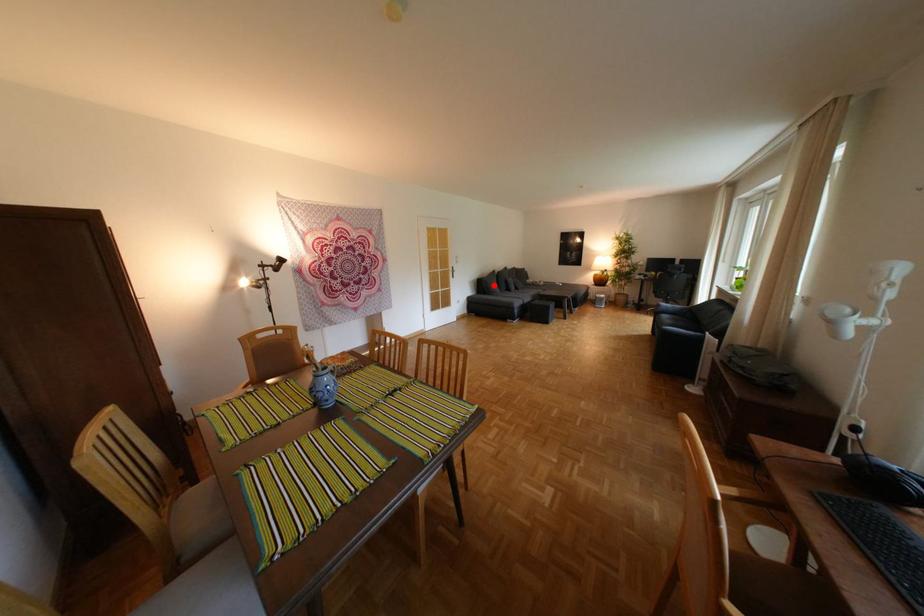
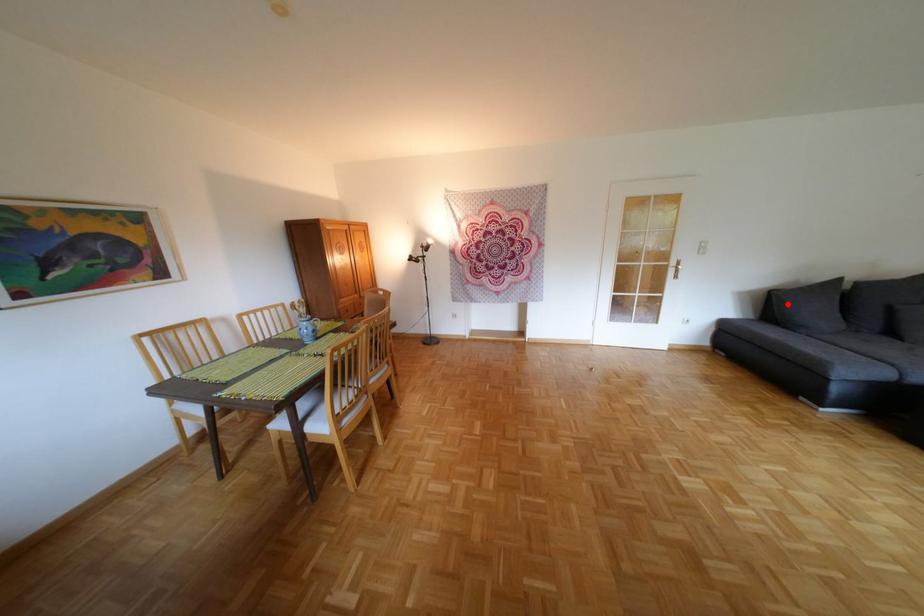
Consider the image. I am providing you with two images of the same scene from different viewpoints. A red point is marked on the first image and another point is marked on the second image. Is the red point in image1 aligned with the point shown in image2?

Yes